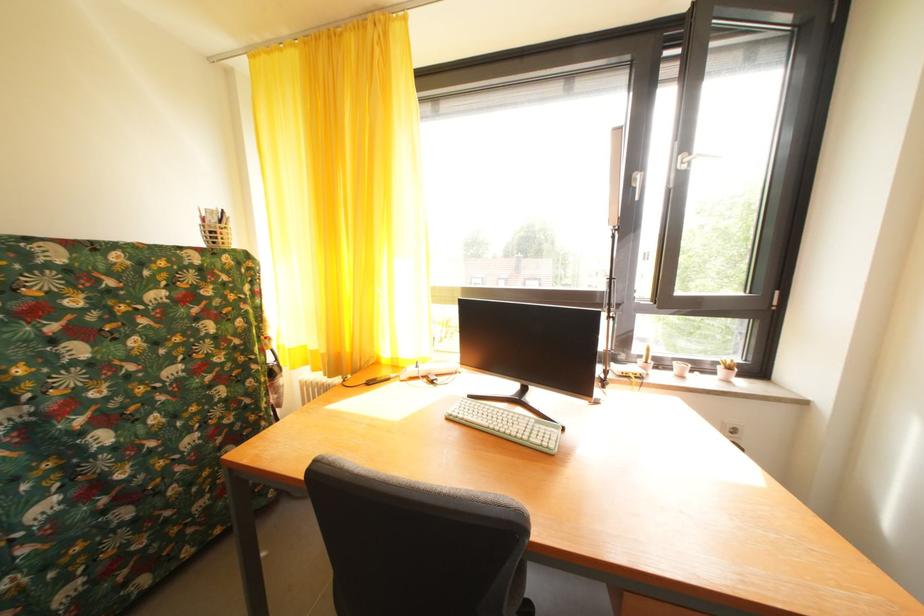
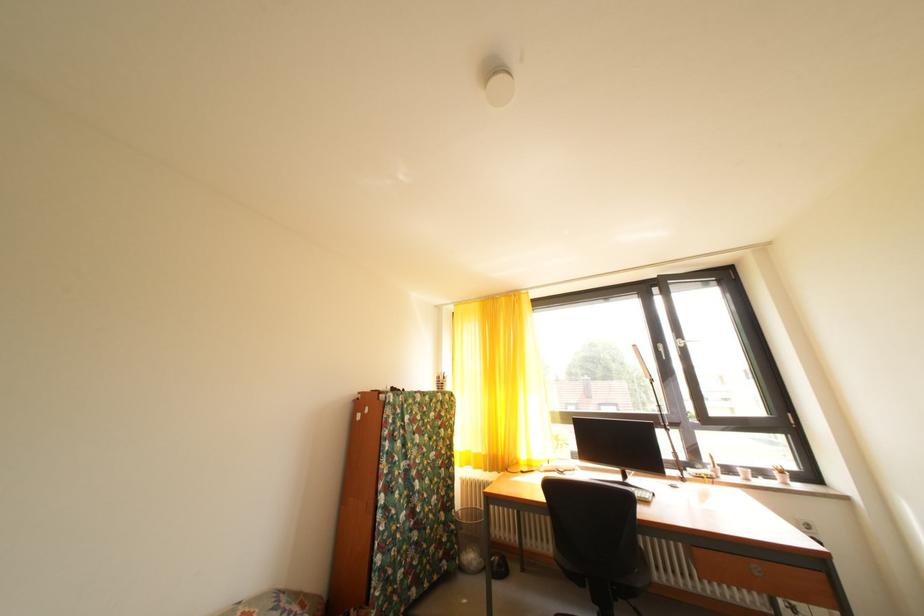
The point at (728, 374) is marked in the first image. Where is the corresponding point in the second image?

(784, 479)